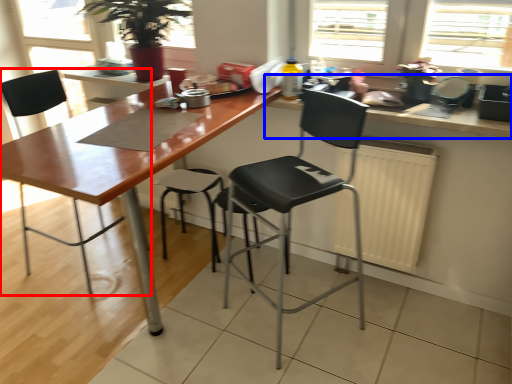
Question: Which of the following is the farthest to the observer, chair (highlighted by a red box) or countertop (highlighted by a blue box)?

Choices:
 (A) chair
 (B) countertop

Answer: (A)